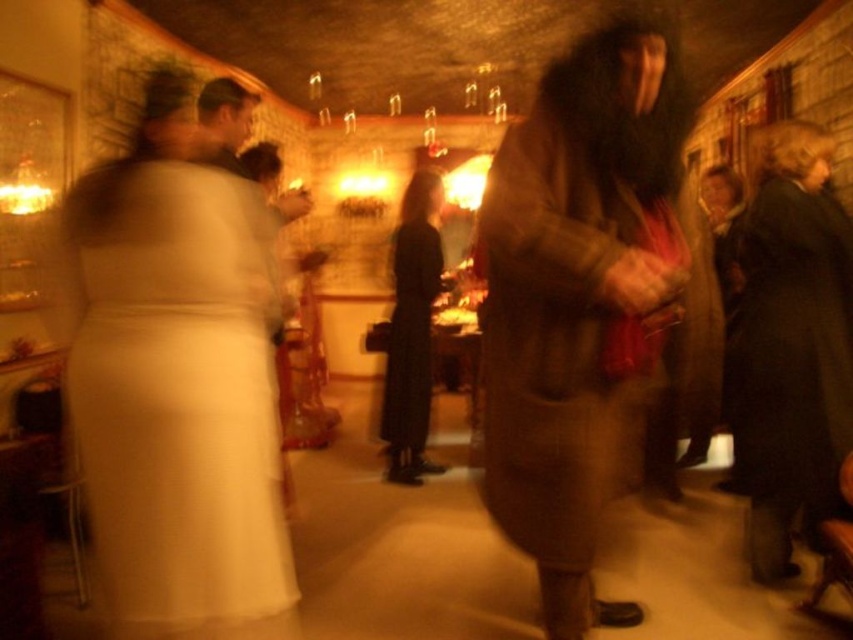
You are taking a photo of the scene and want to ensure both the point at [125,612] and the point at [410,333] are in focus. Given that your camera can only focus on one point at a time, which point should you focus on to have the closest possible focus for both points?

You should focus on point [125,612] because it is closer to the camera than point [410,333], so focusing there will keep both points in better focus.

You are a photographer trying to capture a clear shot of both the white satin dress at left and the black matte dress at center. Since the central figure is slightly out of focus, which dress should you adjust your camera focus to prioritize to ensure it becomes sharp?

The white satin dress at left is located below the black matte dress at center. To ensure the black matte dress at center is sharp, adjust the camera focus to the center position where it is located.